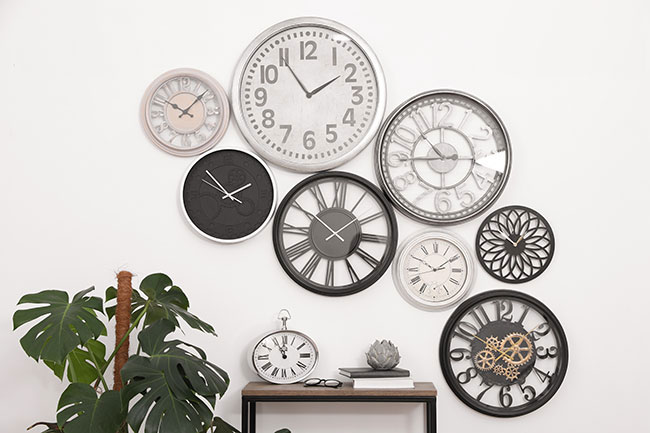
Locate an element on the screen. clock on wall is located at coordinates (519, 338), (446, 273), (536, 241), (465, 177), (292, 228), (312, 106), (240, 175), (194, 105).